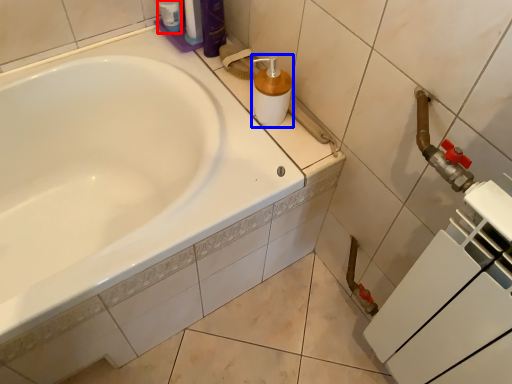
Question: Which of the following is the closest to the observer, toiletry (highlighted by a red box) or soap dispenser (highlighted by a blue box)?

Choices:
 (A) toiletry
 (B) soap dispenser

Answer: (B)